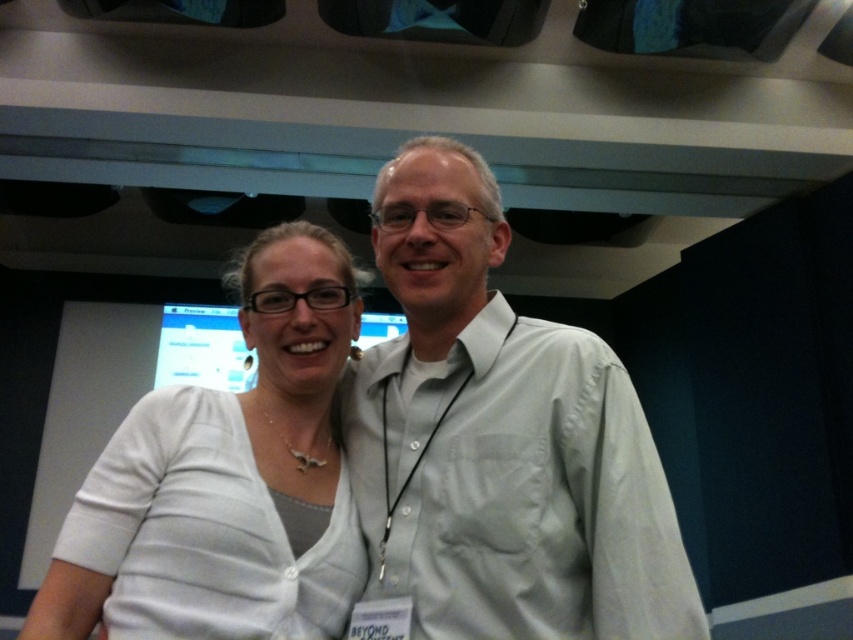
Question: Is light gray shirt at center below white matte shirt at center?

Choices:
 (A) yes
 (B) no

Answer: (B)

Question: Is light gray shirt at center to the left of white matte shirt at center from the viewer's perspective?

Choices:
 (A) yes
 (B) no

Answer: (B)

Question: Does light gray shirt at center have a greater width compared to white matte shirt at center?

Choices:
 (A) yes
 (B) no

Answer: (A)

Question: Which point is farther from the camera taking this photo?

Choices:
 (A) (587, 556)
 (B) (315, 269)

Answer: (B)

Question: Which point is closer to the camera?

Choices:
 (A) (473, 280)
 (B) (287, 396)

Answer: (A)